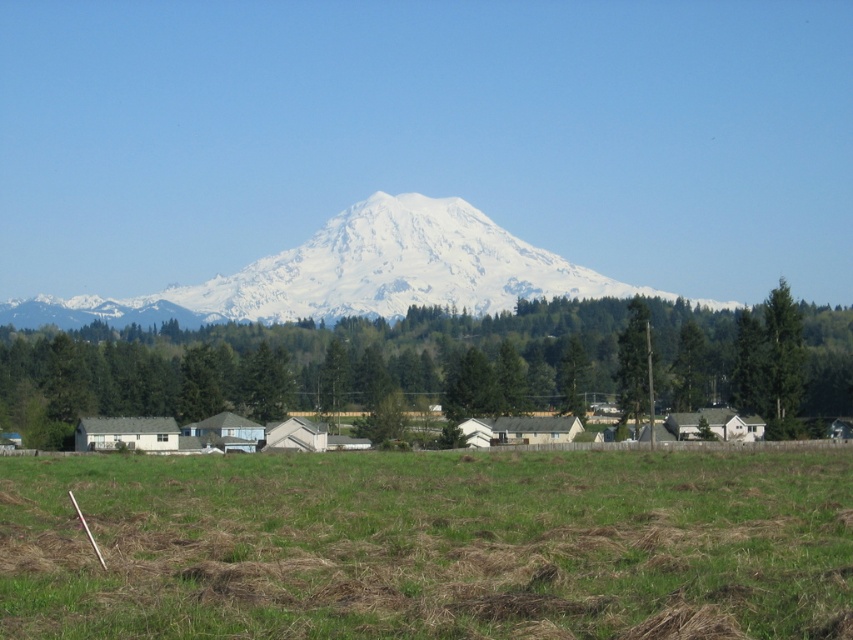
Question: Does green grass at lower center appear under white snow-covered mountain at center?

Choices:
 (A) yes
 (B) no

Answer: (A)

Question: Estimate the real-world distances between objects in this image. Which object is closer to the green grass at lower center?

Choices:
 (A) green textured tree at center
 (B) green textured tree at right
 (C) white snow-covered mountain at center

Answer: (B)

Question: Can you confirm if white snow-covered mountain at center is thinner than green textured tree at right?

Choices:
 (A) yes
 (B) no

Answer: (B)

Question: Is green textured tree at center behind green textured tree at right?

Choices:
 (A) yes
 (B) no

Answer: (A)

Question: Which point is farther to the camera?

Choices:
 (A) white snow-covered mountain at center
 (B) green textured tree at center
 (C) green textured tree at right

Answer: (A)

Question: Which object is farther from the camera taking this photo?

Choices:
 (A) green textured tree at center
 (B) green textured tree at right
 (C) green grass at lower center
 (D) white snow-covered mountain at center

Answer: (D)